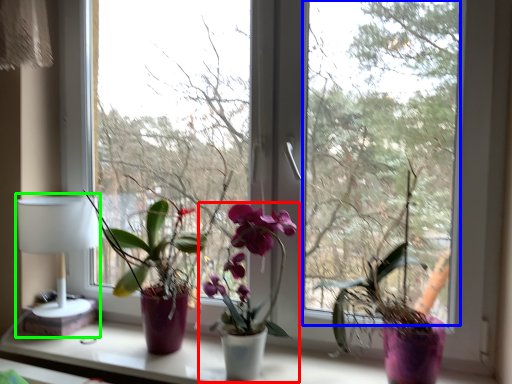
Question: Which object is positioned closest to houseplant (highlighted by a red box)? Select from window screen (highlighted by a blue box) and table lamp (highlighted by a green box).

Choices:
 (A) window screen
 (B) table lamp

Answer: (B)